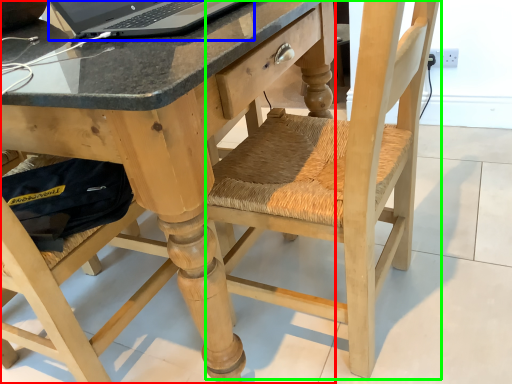
Question: Based on their relative distances, which object is nearer to desk (highlighted by a red box)? Choose from laptop (highlighted by a blue box) and swivel chair (highlighted by a green box).

Choices:
 (A) laptop
 (B) swivel chair

Answer: (A)